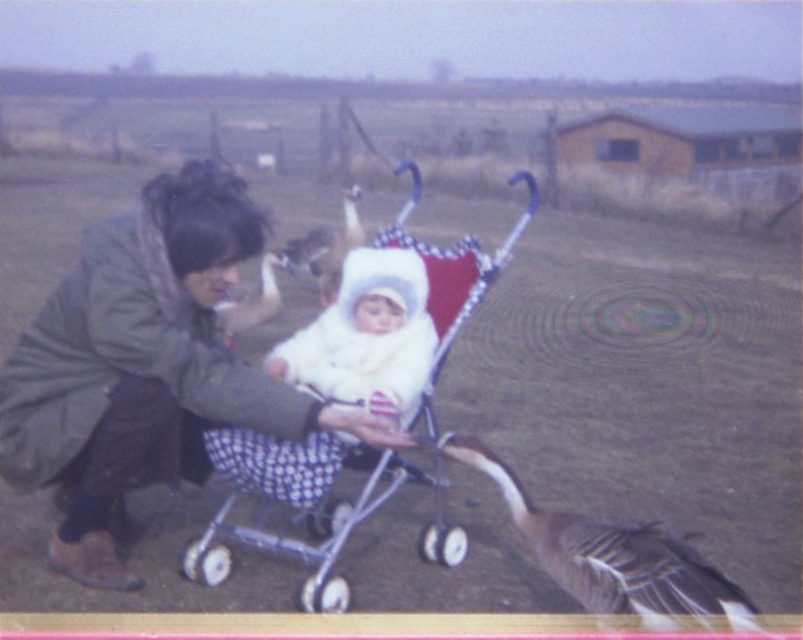
The image size is (803, 640). Describe the element at coordinates (394, 317) in the screenshot. I see `polka dot fabric baby carriage at center` at that location.

Who is taller, polka dot fabric baby carriage at center or white fluffy baby carriage at center?

With more height is polka dot fabric baby carriage at center.

Find the location of a particular element. polka dot fabric baby carriage at center is located at coordinates [x=394, y=317].

Who is positioned more to the left, green fuzzy coat at center or gray feathered goose at lower right?

green fuzzy coat at center is more to the left.

Does point (159, 380) come farther from viewer compared to point (691, 564)?

Yes.

I want to click on green fuzzy coat at center, so click(145, 368).

Can you confirm if green fuzzy coat at center is positioned above white fluffy baby carriage at center?

Incorrect, green fuzzy coat at center is not positioned above white fluffy baby carriage at center.

Is green fuzzy coat at center in front of white fluffy baby carriage at center?

Yes, green fuzzy coat at center is in front of white fluffy baby carriage at center.

This screenshot has height=640, width=803. Identify the location of green fuzzy coat at center. (145, 368).